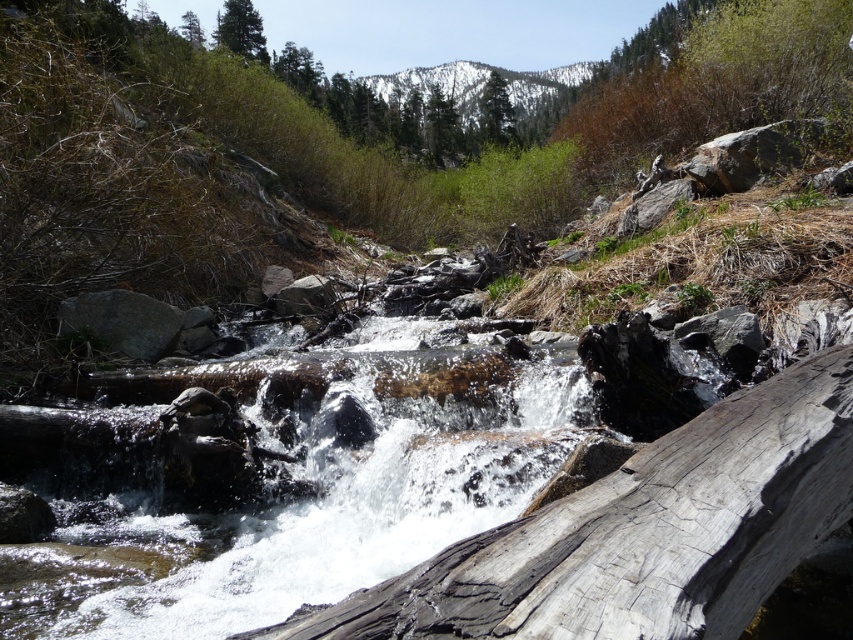
You are a hiker trying to cross the stream. You see the gray rough wood at center and the clear water at center. Which one covers a larger area in the scene?

The clear water at center occupies a larger area than the gray rough wood at center.

You are a hiker who wants to take a photo of both the snowy rocky mountain at upper center and the green matte tree at upper left. Which object should you position to your left side to capture both in the frame?

To capture both the snowy rocky mountain at upper center and the green matte tree at upper left in the frame, position the green matte tree at upper left to your left side since it is located to the left of the snowy rocky mountain at upper center.

You are standing at the point marked by the coordinates point (485,84) in the image. Describe the landscape feature you are currently on.

You are standing on a snowy rocky mountain at upper center.